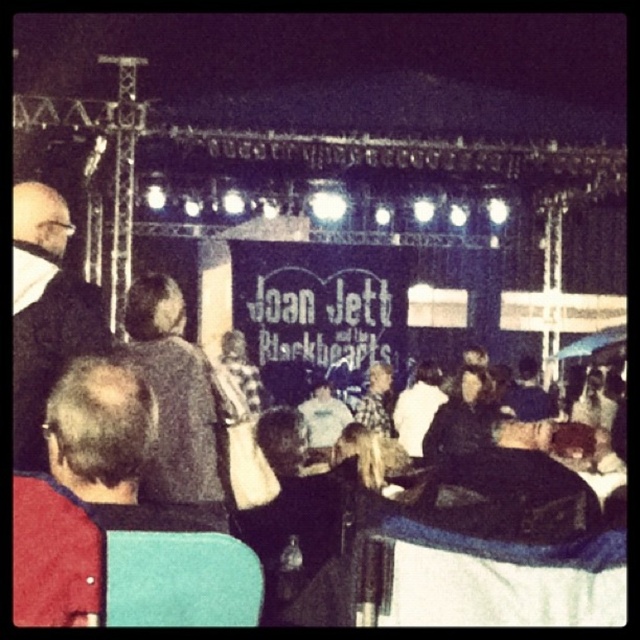
Question: Which object is positioned farthest from the checkered fabric shirt at center?

Choices:
 (A) dark gray sweater at center
 (B) smooth gray shirt at center
 (C) dark gray suit at left

Answer: (C)

Question: Which object is positioned farthest from the checkered fabric shirt at center?

Choices:
 (A) dark gray suit at left
 (B) black matte jacket at center

Answer: (A)

Question: Which object is farther from the camera taking this photo?

Choices:
 (A) checkered fabric shirt at center
 (B) smooth gray shirt at center
 (C) black matte jacket at center

Answer: (A)

Question: Does dark gray suit at left appear over dark gray sweater at center?

Choices:
 (A) yes
 (B) no

Answer: (A)

Question: Is dark gray suit at left above smooth gray shirt at center?

Choices:
 (A) no
 (B) yes

Answer: (B)

Question: Can you confirm if dark gray suit at left is positioned above dark gray sweater at center?

Choices:
 (A) no
 (B) yes

Answer: (B)